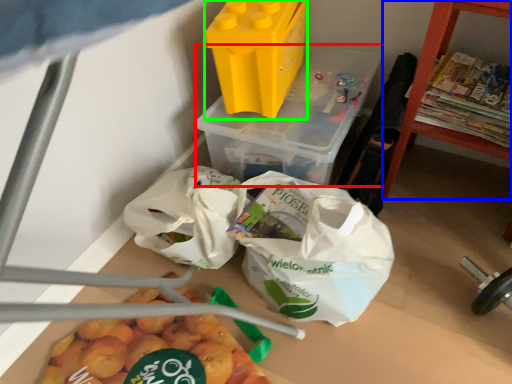
Question: Estimate the real-world distances between objects in this image. Which object is farther from yoghurt (highlighted by a red box), furniture (highlighted by a blue box) or yoghurt (highlighted by a green box)?

Choices:
 (A) furniture
 (B) yoghurt

Answer: (A)